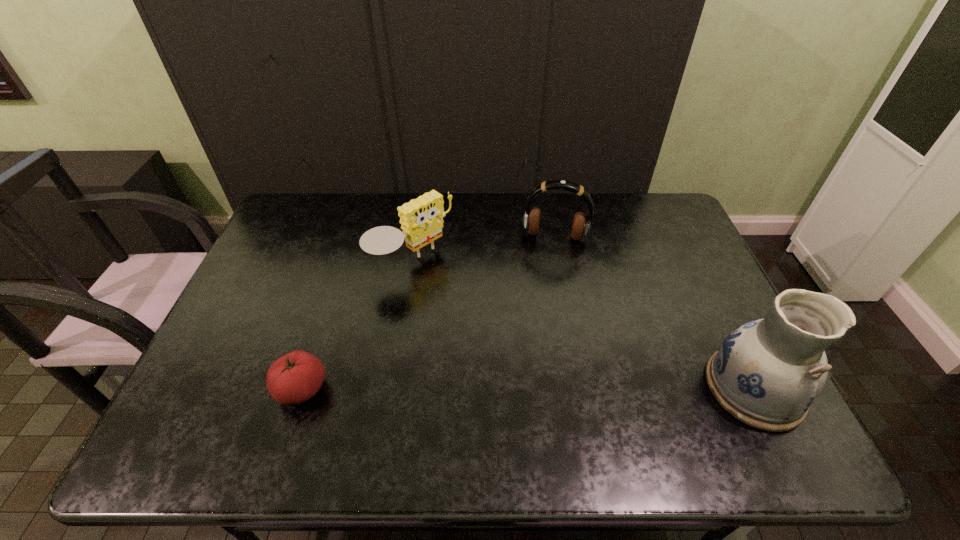
Where is `free spot on the desktop that is between the tomato and the pottery and is positioned on the ear cup of the second object from right to left`? The height and width of the screenshot is (540, 960). free spot on the desktop that is between the tomato and the pottery and is positioned on the ear cup of the second object from right to left is located at coordinates (536, 388).

The height and width of the screenshot is (540, 960). Find the location of `free spot on the desktop that is between the leftmost object and the tallest object and is positioned on the front-facing side of the sponge`. free spot on the desktop that is between the leftmost object and the tallest object and is positioned on the front-facing side of the sponge is located at coordinates (565, 388).